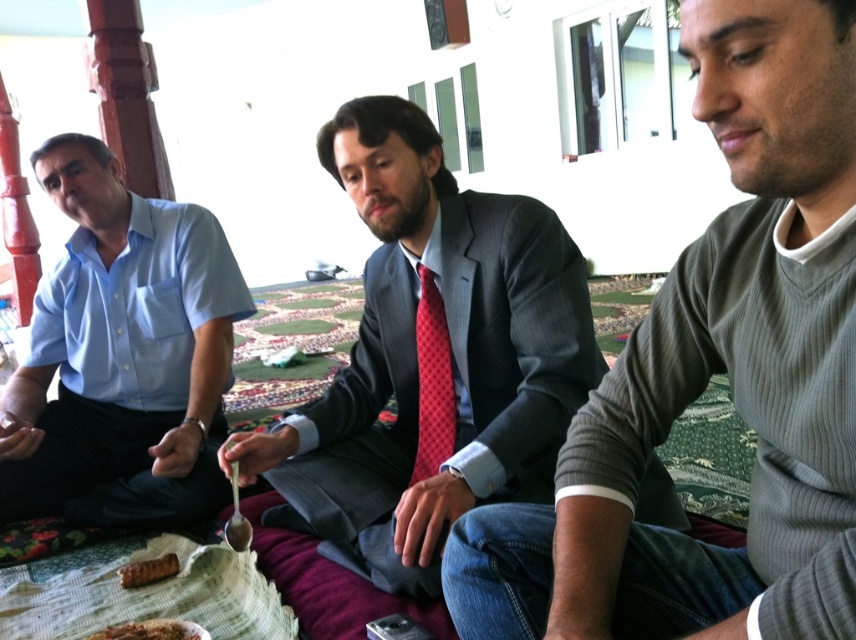
What are the coordinates of the red dotted tie at center?

The red dotted tie at center is located at coordinates point [432,381].

You are a photographer taking a picture of the scene. To ensure both the red dotted tie at center and the brown crumbly bread at lower left are in focus, which object should you adjust the camera focus on first?

The red dotted tie at center is taller than the brown crumbly bread at lower left, so you should focus on the red dotted tie at center first to ensure both are in focus.